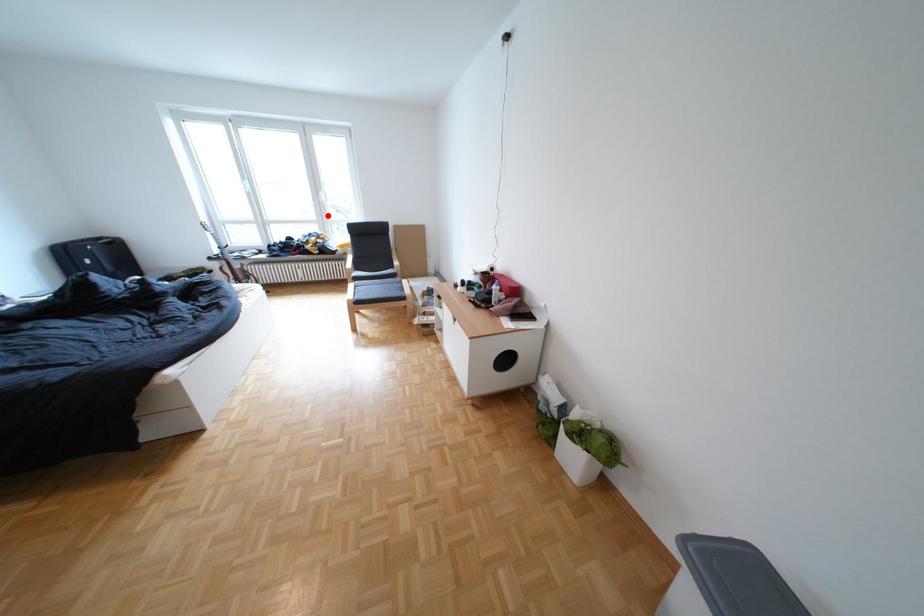
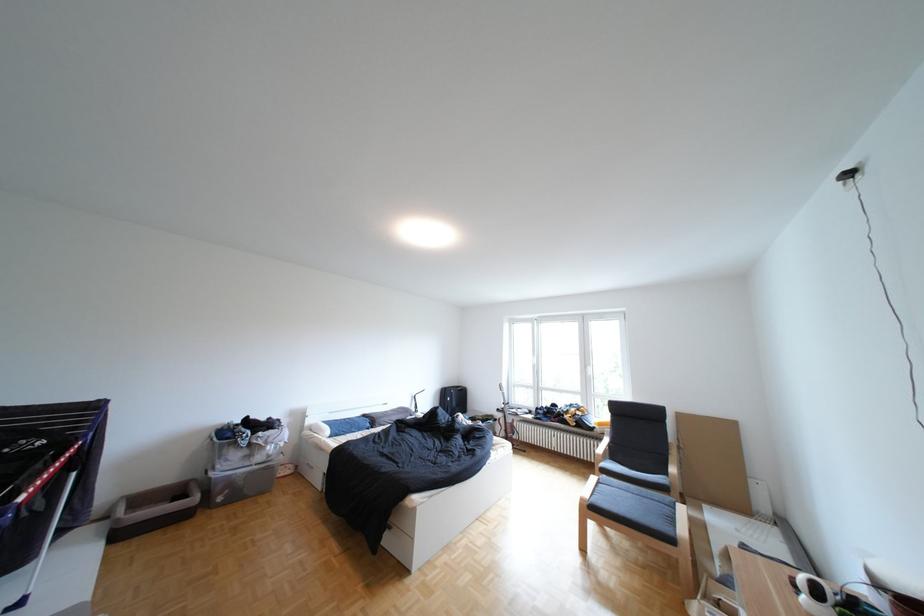
Question: I am providing you with two images of the same scene from different viewpoints. Given a red point in image1, look at the same physical point in image2. Is it:

Choices:
 (A) Closer to the viewpoint
 (B) Farther from the viewpoint

Answer: (B)